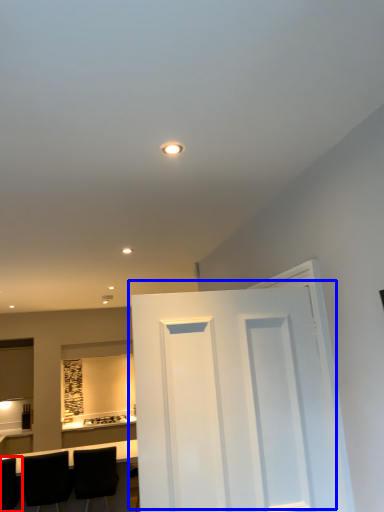
Question: Among these objects, which one is nearest to the camera, chair (highlighted by a red box) or door (highlighted by a blue box)?

Choices:
 (A) chair
 (B) door

Answer: (B)